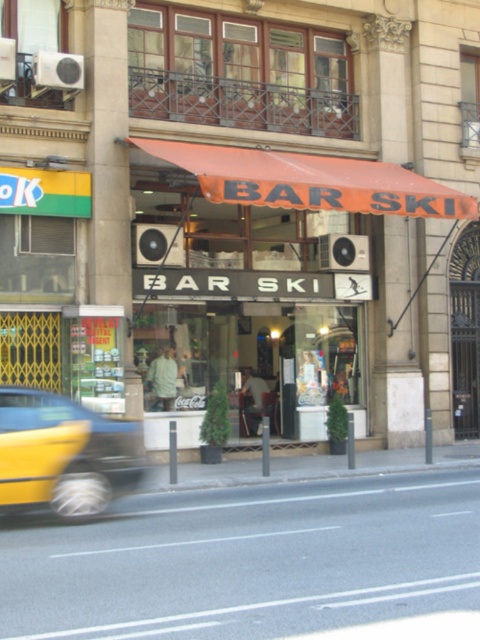
You are standing at the entrance of BAR SKI and looking towards the street. There are two points marked on the ground in front of you. One is at point coordinates point (x=336, y=508) and the other at point coordinates point (x=64, y=417). Which point is closer to you?

Point (x=64, y=417) is closer to you because it is in front of point (x=336, y=508), which is behind it.